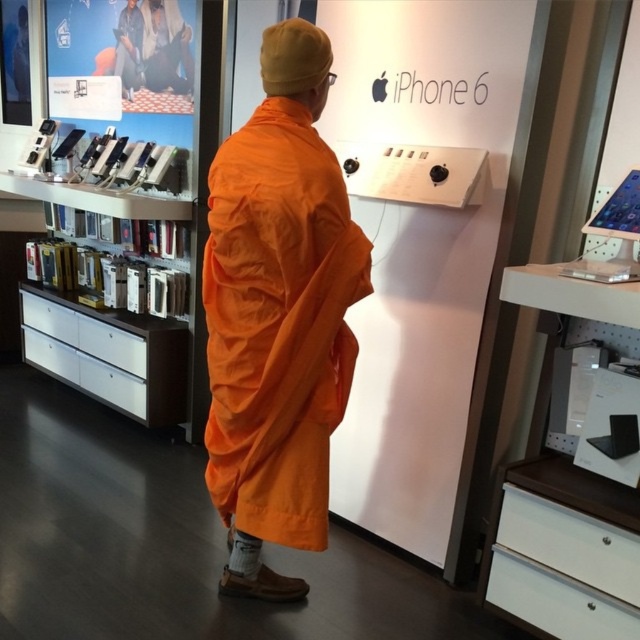
Is orange fabric at center above white glossy bookshelf at left?

Incorrect, orange fabric at center is not positioned above white glossy bookshelf at left.

Is orange fabric at center behind white glossy bookshelf at left?

No, it is not.

Who is more distant from viewer, (250, 282) or (195, 272)?

Positioned behind is point (195, 272).

Image resolution: width=640 pixels, height=640 pixels. What are the coordinates of `orange fabric at center` in the screenshot? It's located at (278, 314).

Between orange fabric at center and white matte bookshelf at lower right, which one appears on the right side from the viewer's perspective?

white matte bookshelf at lower right is more to the right.

Does point (227, 374) come behind point (502, 568)?

No, (227, 374) is closer to viewer.

Who is more distant from viewer, (289, 596) or (630, 316)?

Positioned behind is point (289, 596).

Locate an element on the screen. orange fabric at center is located at coordinates (278, 314).

Find the location of a particular element. Image resolution: width=640 pixels, height=640 pixels. white matte bookshelf at lower right is located at coordinates (564, 550).

Does white matte bookshelf at lower right have a greater width compared to white glossy bookshelf at left?

No, white matte bookshelf at lower right is not wider than white glossy bookshelf at left.

Locate an element on the screen. white matte bookshelf at lower right is located at coordinates (564, 550).

The height and width of the screenshot is (640, 640). What are the coordinates of `white matte bookshelf at lower right` in the screenshot? It's located at (564, 550).